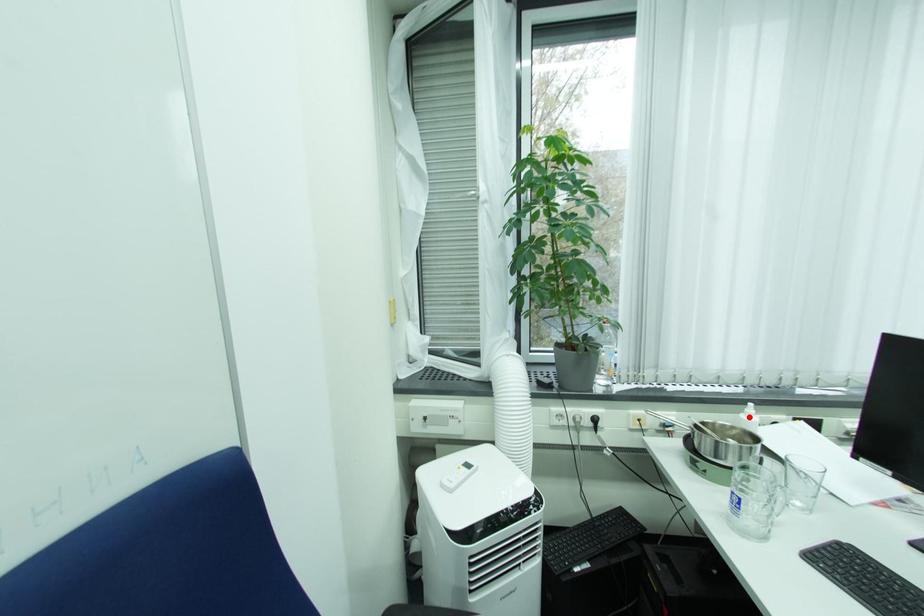
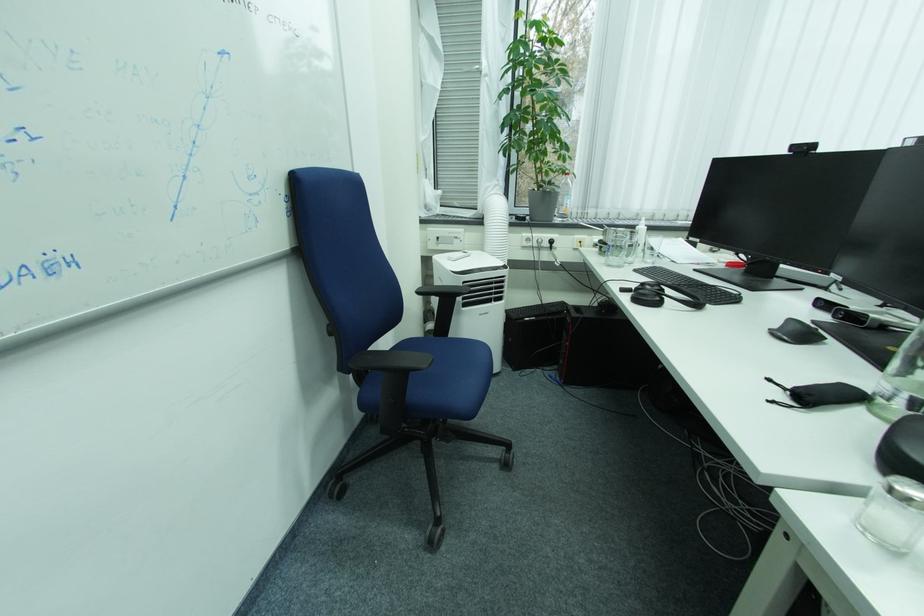
Locate, in the second image, the point that corresponds to the highlighted location in the first image.

(643, 227)